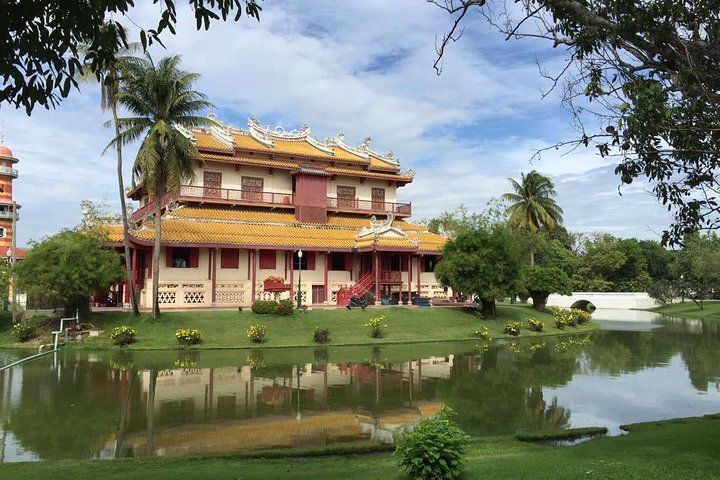
I want to click on upper windows, so click(x=209, y=181), click(x=247, y=181), click(x=346, y=196), click(x=381, y=192).